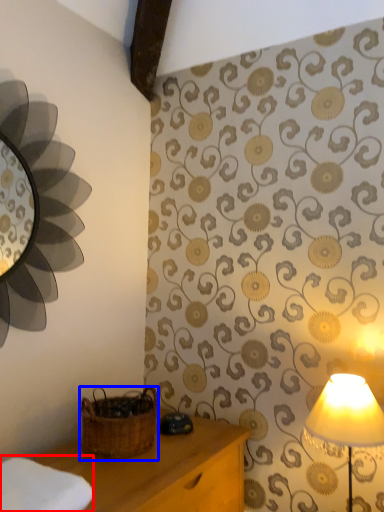
Question: Among these objects, which one is nearest to the camera, cloth (highlighted by a red box) or basket (highlighted by a blue box)?

Choices:
 (A) cloth
 (B) basket

Answer: (A)